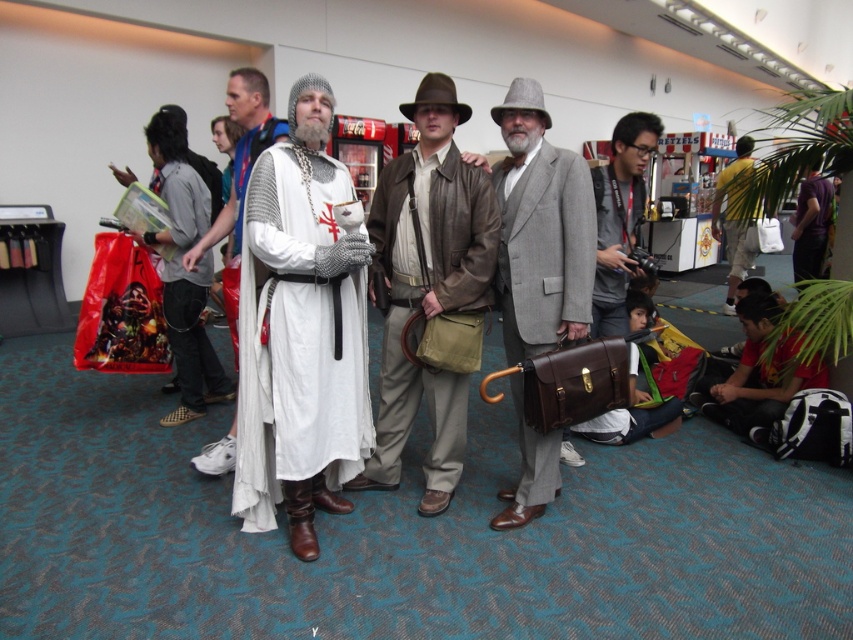
Question: Estimate the real-world distances between objects in this image. Which object is closer to the purple fabric shirt at right?

Choices:
 (A) white fabric robe at center
 (B) yellow fabric shirt at right

Answer: (B)

Question: Which of these objects is positioned farthest from the matte gray jacket at center?

Choices:
 (A) gray wool suit at center
 (B) yellow fabric shirt at right
 (C) white fabric robe at center

Answer: (B)

Question: Which of the following is the closest to the observer?

Choices:
 (A) (180, 348)
 (B) (636, 131)
 (C) (320, 468)

Answer: (C)

Question: Does matte gray jacket at center appear on the left side of white fabric robe at center?

Choices:
 (A) no
 (B) yes

Answer: (A)

Question: Does gray wool suit at center appear on the right side of matte gray jacket at center?

Choices:
 (A) yes
 (B) no

Answer: (B)

Question: Can you confirm if white fabric cape at center is positioned above yellow fabric shirt at right?

Choices:
 (A) yes
 (B) no

Answer: (B)